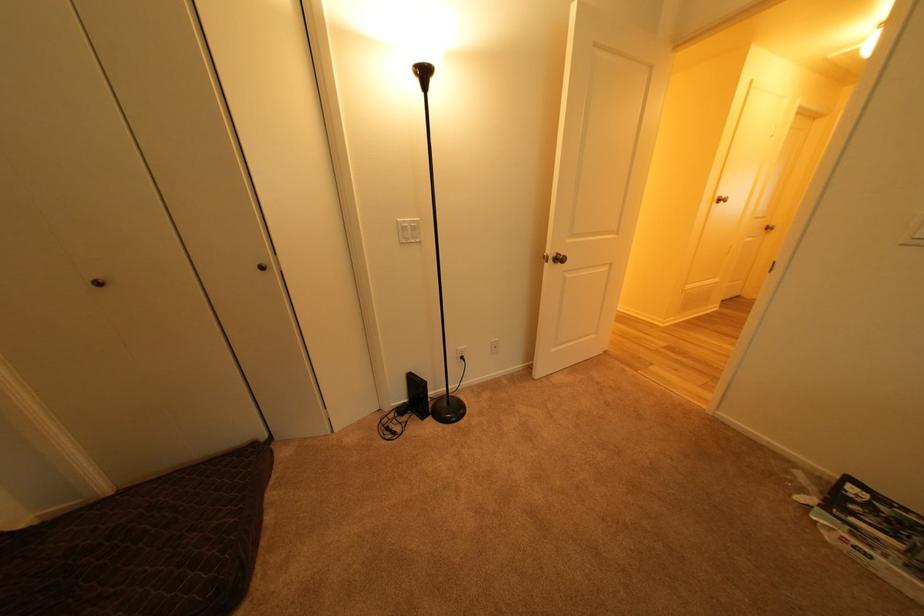
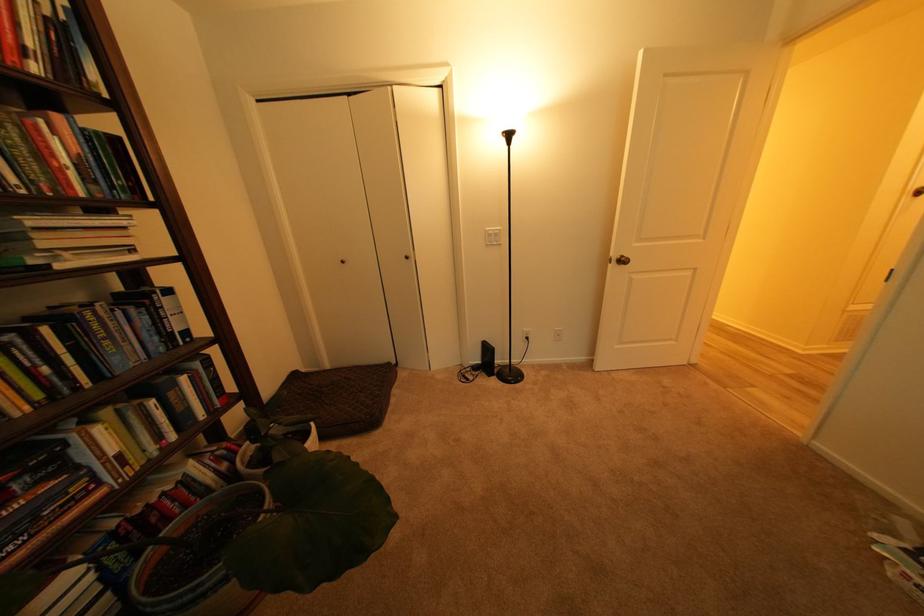
Locate, in the second image, the point that corresponds to [408,223] in the first image.

(495, 232)